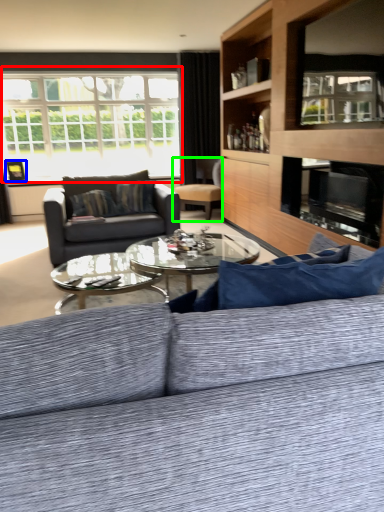
Question: Estimate the real-world distances between objects in this image. Which object is closer to window (highlighted by a red box), picture frame (highlighted by a blue box) or chair (highlighted by a green box)?

Choices:
 (A) picture frame
 (B) chair

Answer: (A)